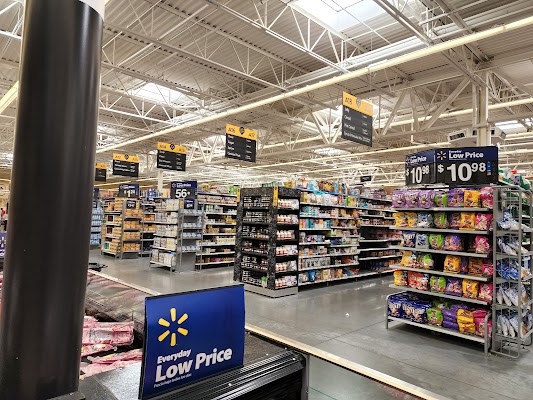
This screenshot has width=533, height=400. What are the coordinates of `floor` in the screenshot? It's located at (348, 324).